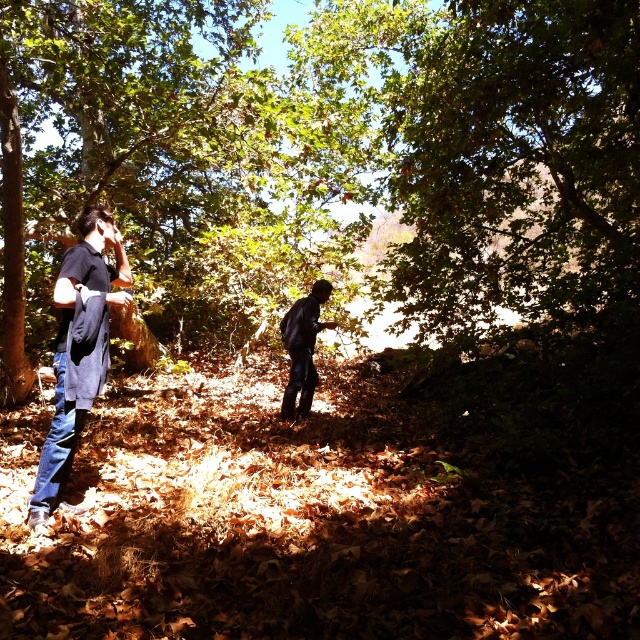
Question: Is denim jacket at left positioned in front of dark blue jeans at center?

Choices:
 (A) yes
 (B) no

Answer: (A)

Question: Is denim jacket at left in front of dark blue jeans at center?

Choices:
 (A) no
 (B) yes

Answer: (B)

Question: Which of the following is the closest to the observer?

Choices:
 (A) (305, 330)
 (B) (120, 272)

Answer: (B)

Question: Which point is farther from the camera taking this photo?

Choices:
 (A) (284, 413)
 (B) (49, 512)

Answer: (A)

Question: Is denim jacket at left further to the viewer compared to dark blue jeans at center?

Choices:
 (A) yes
 (B) no

Answer: (B)